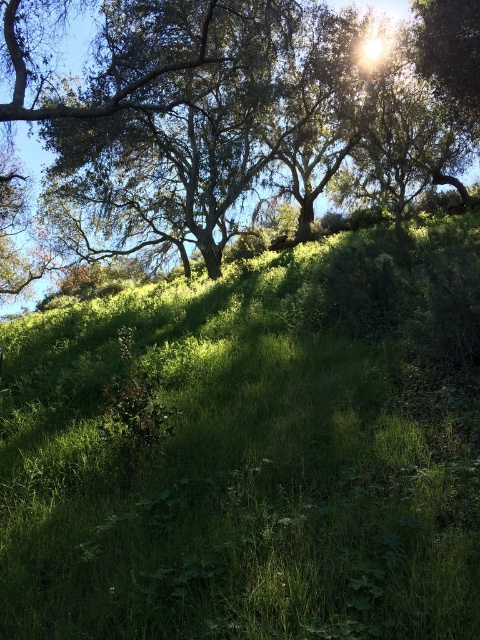
You are a hiker planning to walk from the green grassy hillside at upper center to the green leafy tree at upper left. Given that the distance between them is 16.19 meters, can you estimate how long it would take you to walk this distance at a moderate pace?

At a moderate walking pace of approximately 1.4 meters per second, it would take roughly 11.56 seconds to cover the 16.19 meters between the green grassy hillside at upper center and the green leafy tree at upper left.